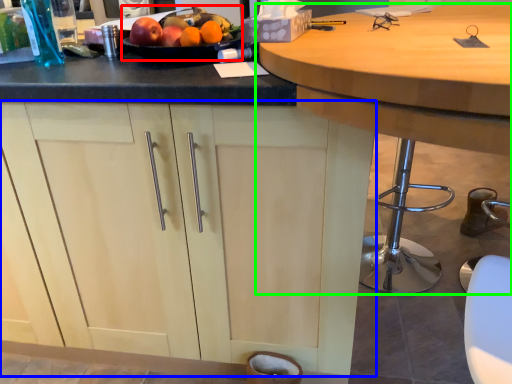
Question: Which object is positioned closest to fruit dish (highlighted by a red box)? Select from cabinetry (highlighted by a blue box) and table (highlighted by a green box).

Choices:
 (A) cabinetry
 (B) table

Answer: (B)